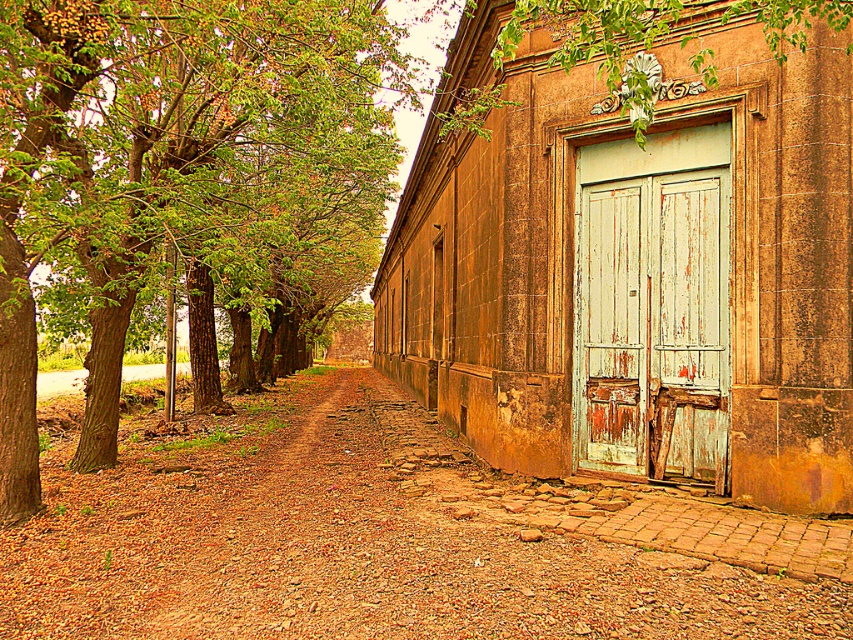
You are standing at a point 14.65 feet away from the camera. You want to walk towards the building in the image. Will you pass through the point marked as point (201, 621)? Please explain your reasoning.

Yes, because the point (201, 621) is exactly 14.65 feet away from the camera. Since you are starting at a point 14.65 feet away from the camera and walking towards the building, you will pass through point (201, 621) on your path.

You are standing at the entrance of the building and want to walk to the brown gravel path at center. Which direction should you walk to reach it?

The brown gravel path at center is located at point (347, 541), so you should walk forward to reach it.

You are standing at the entrance of the building and want to walk to the brown gravel path at center. Which direction should you move relative to the peeling white wood door at right?

The brown gravel path at center is larger in size than the peeling white wood door at right, so you should move towards the brown gravel path at center which is located at the center of the scene relative to the peeling white wood door at right.